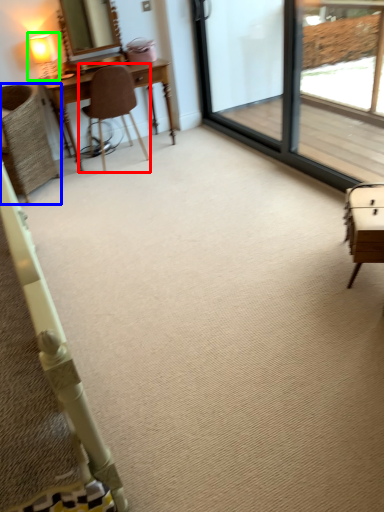
Question: Which object is positioned closest to chair (highlighted by a red box)? Select from chair (highlighted by a blue box) and table lamp (highlighted by a green box).

Choices:
 (A) chair
 (B) table lamp

Answer: (A)